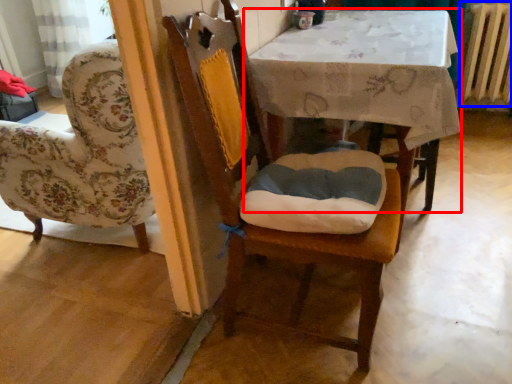
Question: Which of the following is the closest to the observer, table (highlighted by a red box) or radiator (highlighted by a blue box)?

Choices:
 (A) table
 (B) radiator

Answer: (A)